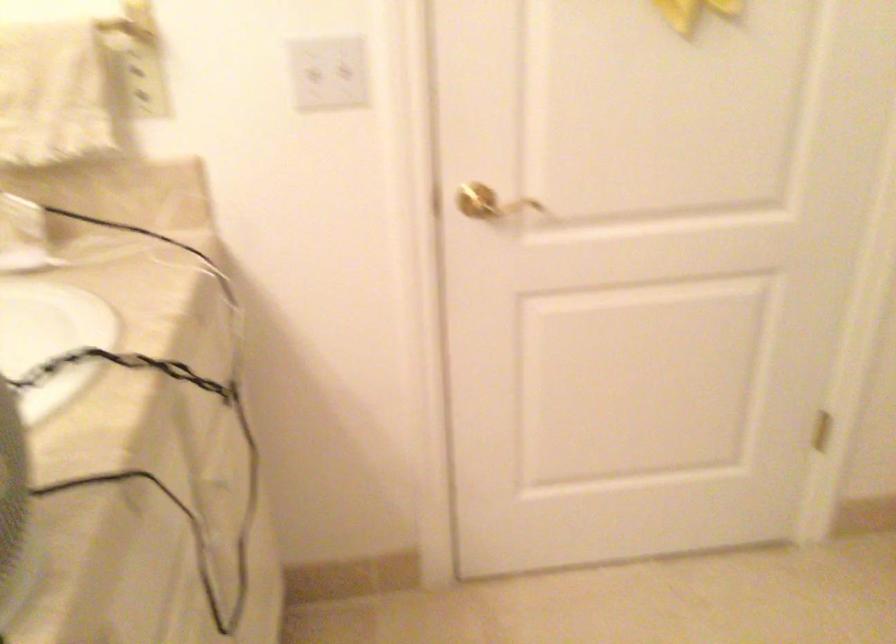
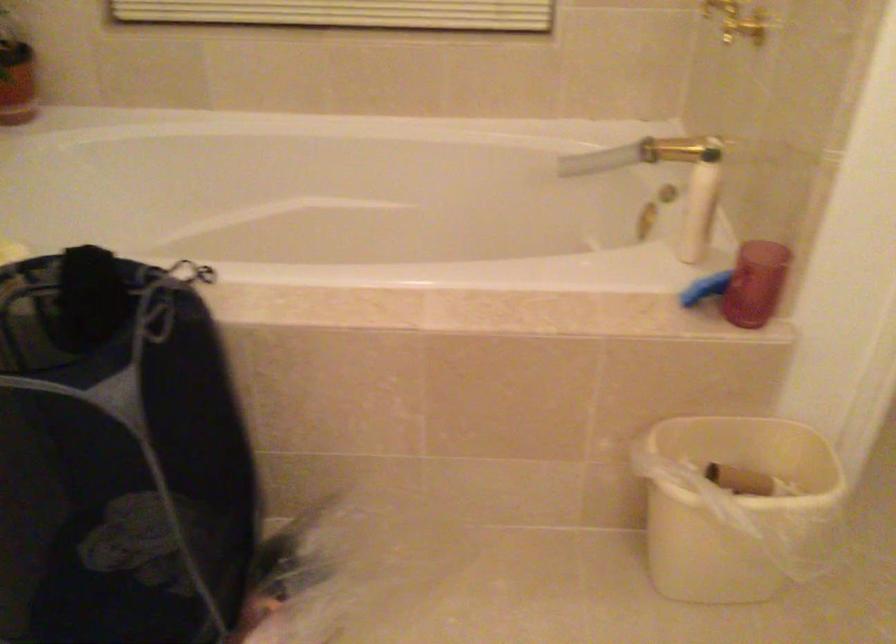
Based on the continuous images, in which direction is the camera rotating?

The camera's rotation is toward right-down.